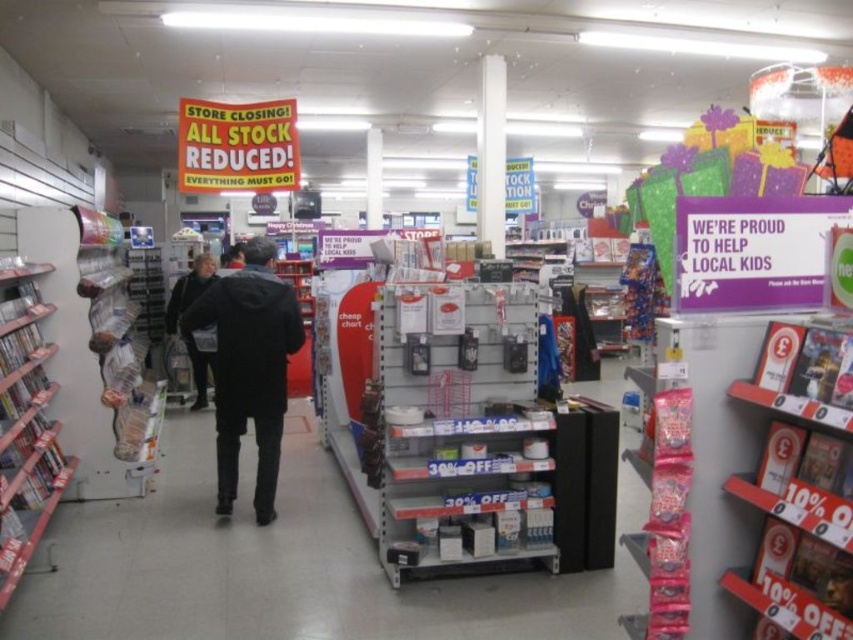
Question: Among these objects, which one is farthest from the camera?

Choices:
 (A) dark gray sweater at center
 (B) black matte jacket at center

Answer: (A)

Question: Does black matte jacket at center have a lesser width compared to dark gray sweater at center?

Choices:
 (A) yes
 (B) no

Answer: (A)

Question: Can you confirm if black matte jacket at center is positioned above dark gray sweater at center?

Choices:
 (A) no
 (B) yes

Answer: (A)

Question: Can you confirm if black matte jacket at center is bigger than dark gray sweater at center?

Choices:
 (A) yes
 (B) no

Answer: (B)

Question: Which of the following is the closest to the observer?

Choices:
 (A) (234, 456)
 (B) (186, 288)

Answer: (A)

Question: Which object is farther from the camera taking this photo?

Choices:
 (A) dark gray sweater at center
 (B) black matte jacket at center

Answer: (A)